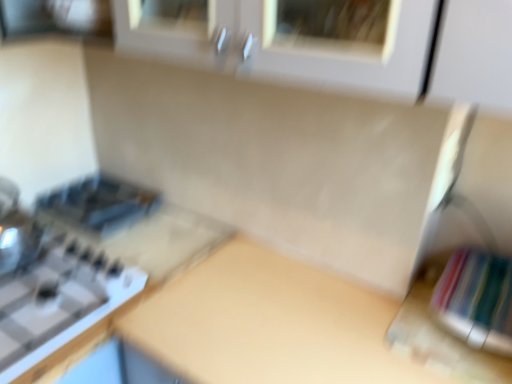
Where is `blank space above satin black toaster at left (from a real-world perspective)`? The height and width of the screenshot is (384, 512). blank space above satin black toaster at left (from a real-world perspective) is located at coordinates (x=114, y=197).